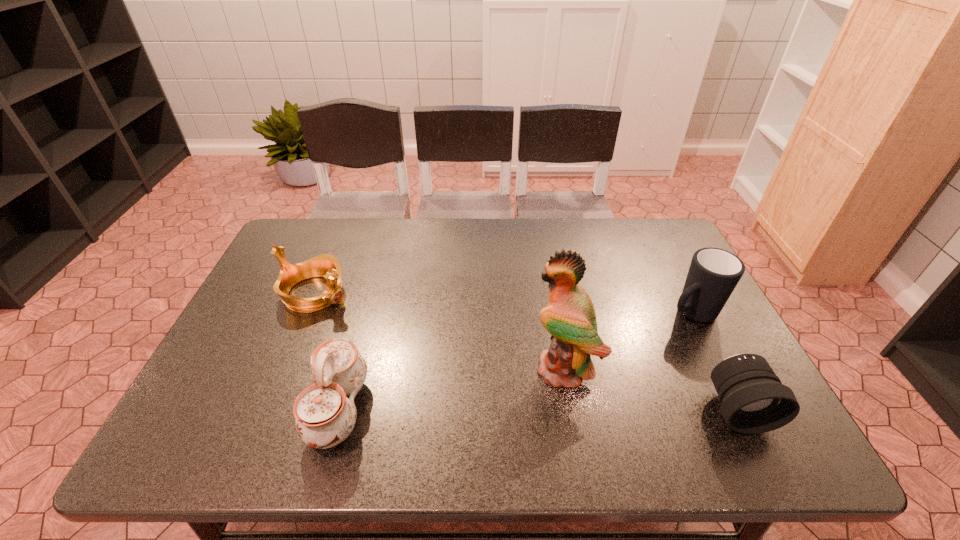
Identify the location of free space that is in between the tallest object and the tiara. (440, 329).

The height and width of the screenshot is (540, 960). In order to click on vacant space that's between the mug and the chinaware in this screenshot , I will do `click(515, 361)`.

Locate an element on the screen. vacant area that lies between the telephoto lens and the mug is located at coordinates (713, 360).

Identify the location of unoccupied position between the parrot and the telephoto lens. The width and height of the screenshot is (960, 540). (650, 387).

Where is `vacant space in between the mug and the telephoto lens`? The width and height of the screenshot is (960, 540). vacant space in between the mug and the telephoto lens is located at coordinates (713, 360).

The image size is (960, 540). Find the location of `free spot between the tiara and the mug`. free spot between the tiara and the mug is located at coordinates (503, 302).

The image size is (960, 540). I want to click on unoccupied area between the tiara and the mug, so click(503, 302).

Locate an element on the screen. free space between the tallest object and the chinaware is located at coordinates (451, 387).

Where is `empty space between the tallest object and the chinaware`? The image size is (960, 540). empty space between the tallest object and the chinaware is located at coordinates (451, 387).

What are the coordinates of `empty space between the telephoto lens and the tiara` in the screenshot? It's located at (525, 350).